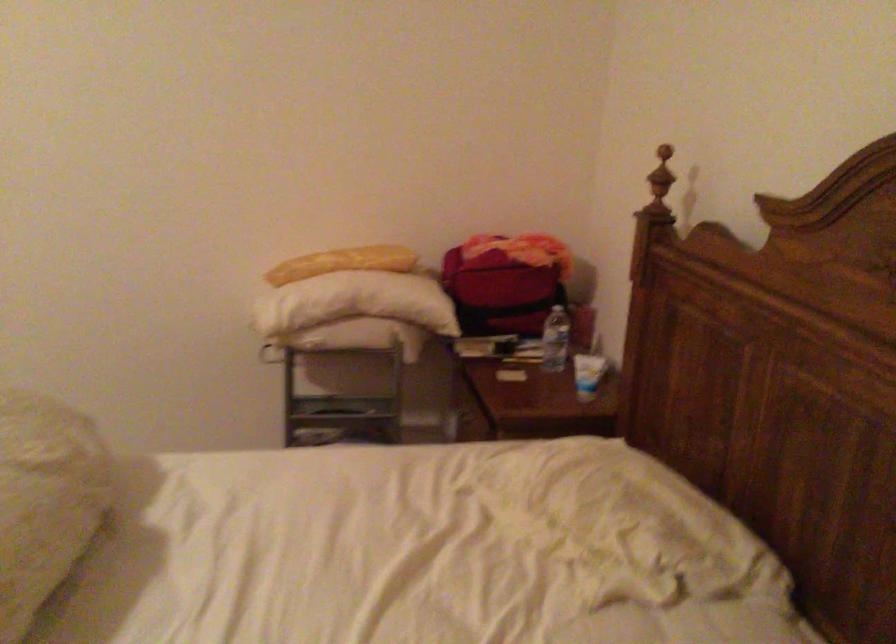
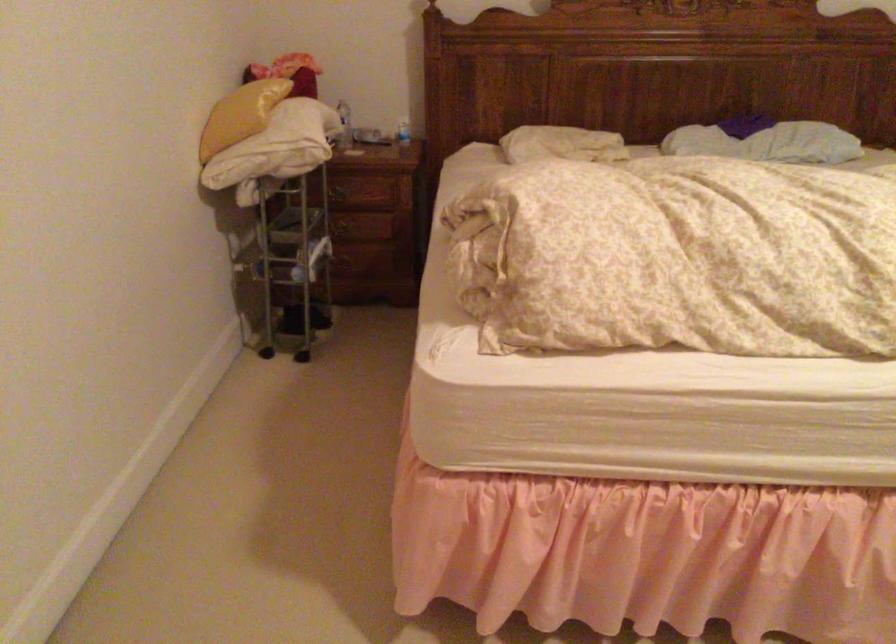
In the second image, find the point that corresponds to point (567, 498) in the first image.

(561, 144)